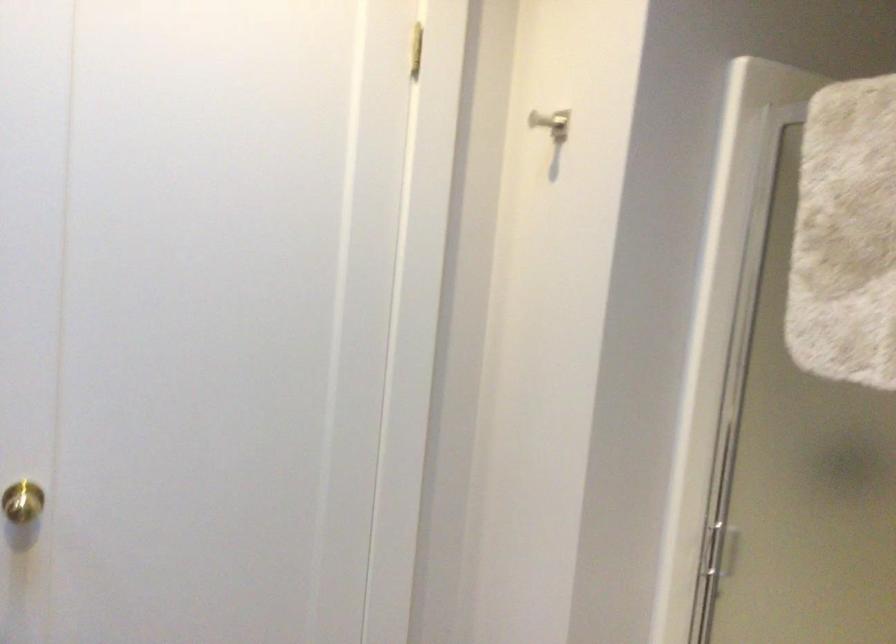
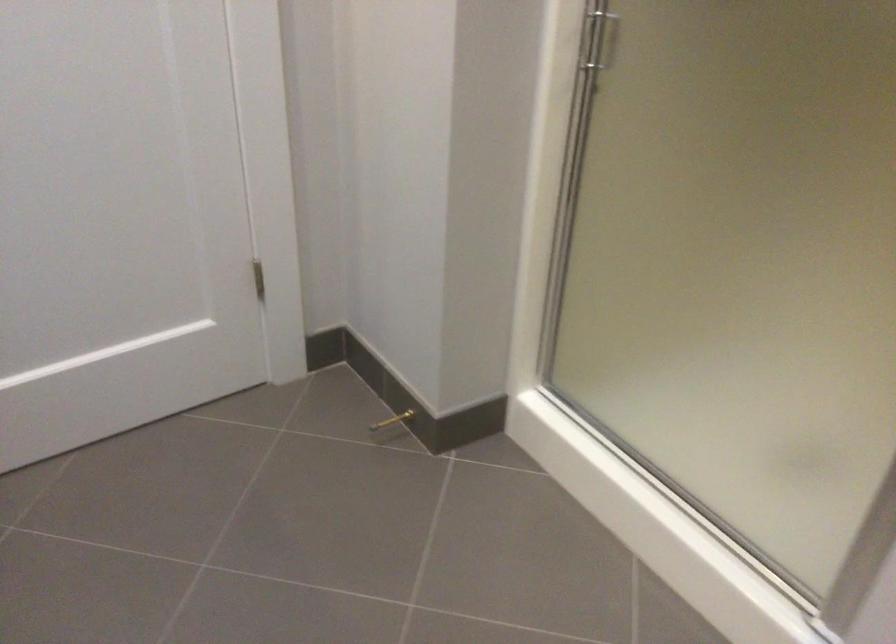
Question: Based on the continuous images, in which direction is the camera rotating? Reply with the corresponding letter.

Choices:
 (A) Left
 (B) Right
 (C) Up
 (D) Down

Answer: (D)